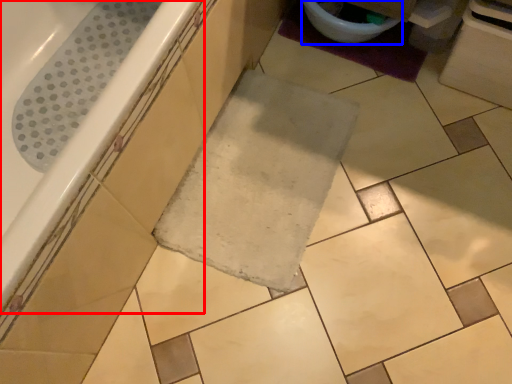
Question: Which object appears closest to the camera in this image, bathtub (highlighted by a red box) or toilet bowl (highlighted by a blue box)?

Choices:
 (A) bathtub
 (B) toilet bowl

Answer: (A)